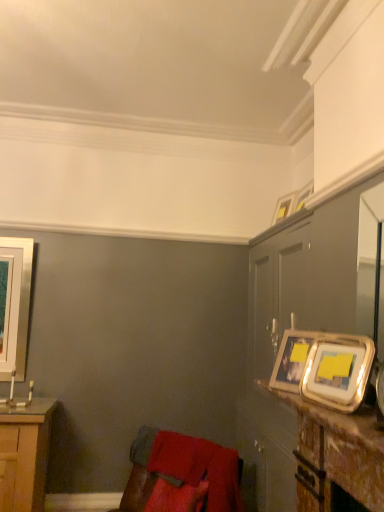
Question: From a real-world perspective, relative to silver metallic picture frame at right, which appears as the second picture frame when viewed from the right, is wooden table at right vertically above or below?

Choices:
 (A) below
 (B) above

Answer: (A)

Question: Would you say wooden table at right is to the left or to the right of silver metallic picture frame at right, the first picture frame positioned from the front, in the picture?

Choices:
 (A) right
 (B) left

Answer: (A)

Question: Based on their relative distances, which object is nearer to the silver metallic picture frame at right, which appears as the second picture frame when viewed from the right?

Choices:
 (A) metallic gold frame at upper right
 (B) silver metallic picture frame at left, the first picture frame viewed from the back
 (C) metallic silver picture frame at upper right, acting as the 3th picture frame starting from the right
 (D) wooden table at right
 (E) velvet red swivel chair at lower left

Answer: (C)

Question: Estimate the real-world distances between objects in this image. Which object is farther from the silver metallic picture frame at right, which appears as the second picture frame when viewed from the right?

Choices:
 (A) silver metallic picture frame at left, the 4th picture frame from the front
 (B) metallic gold picture frame at upper right, the second picture frame in the back-to-front sequence
 (C) velvet red swivel chair at lower left
 (D) metallic gold frame at upper right
 (E) wooden table at right

Answer: (A)